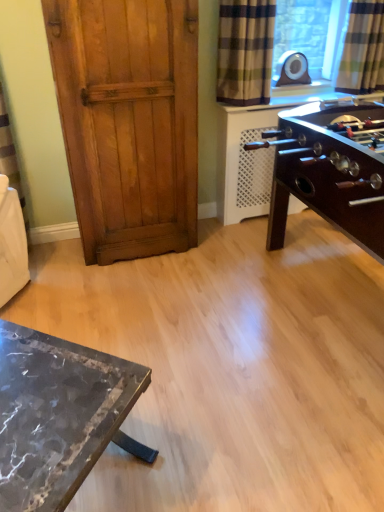
Image resolution: width=384 pixels, height=512 pixels. In order to click on vacant space to the right of marble table at lower left in this screenshot , I will do `click(198, 434)`.